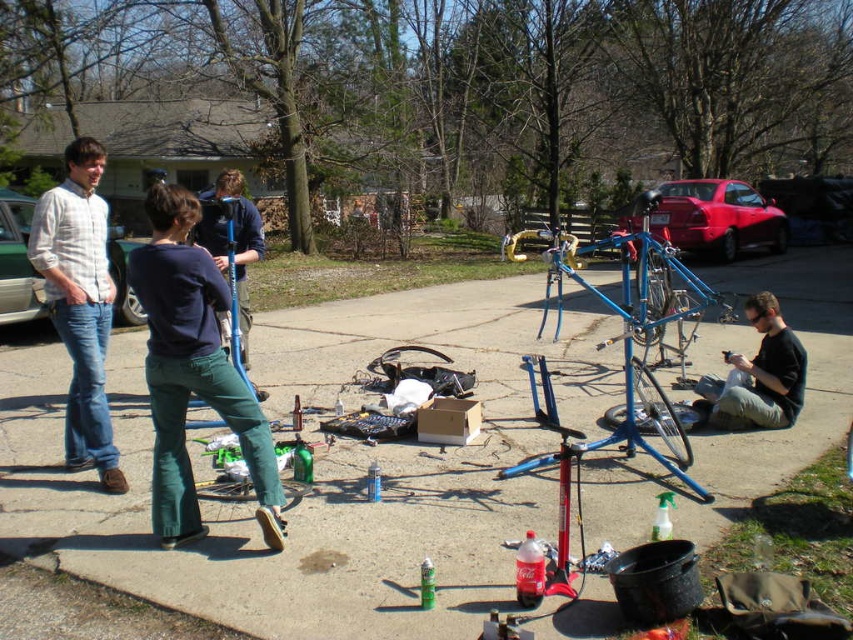
Question: Is light brown plaid shirt at left further to the viewer compared to black matte shirt at center?

Choices:
 (A) yes
 (B) no

Answer: (B)

Question: Which object is positioned closest to the dark blue shirt at center?

Choices:
 (A) light brown plaid shirt at left
 (B) smooth concrete pavement at center

Answer: (A)

Question: Where is smooth concrete pavement at center located in relation to dark blue shirt at center in the image?

Choices:
 (A) right
 (B) left

Answer: (A)

Question: Which object is closer to the camera taking this photo?

Choices:
 (A) light brown plaid shirt at left
 (B) smooth concrete pavement at center
 (C) black matte shirt at center
 (D) dark blue shirt at center

Answer: (B)

Question: Which of these objects is positioned farthest from the dark blue shirt at center?

Choices:
 (A) black matte shirt at center
 (B) smooth concrete pavement at center

Answer: (A)

Question: Can you confirm if dark blue shirt at center is positioned to the right of light brown plaid shirt at left?

Choices:
 (A) yes
 (B) no

Answer: (A)